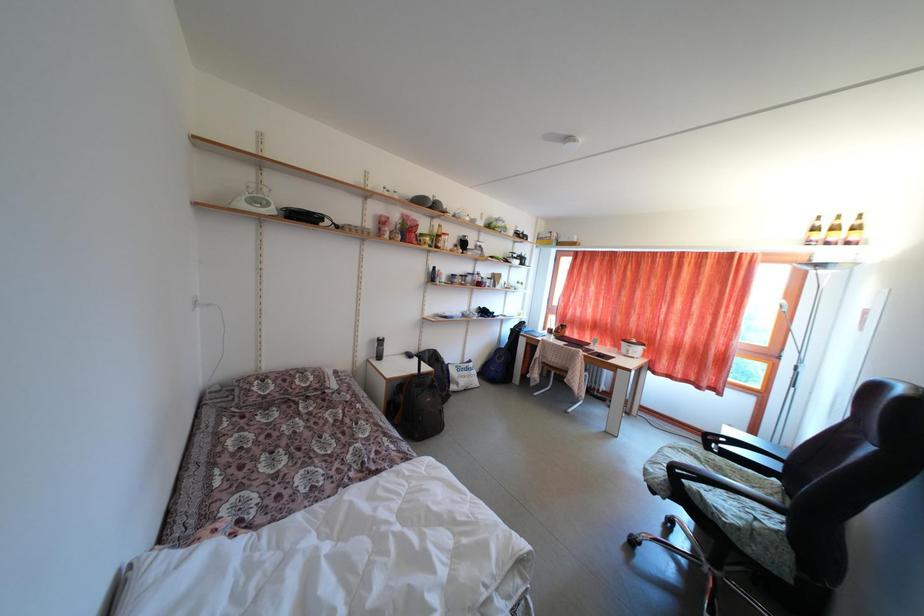
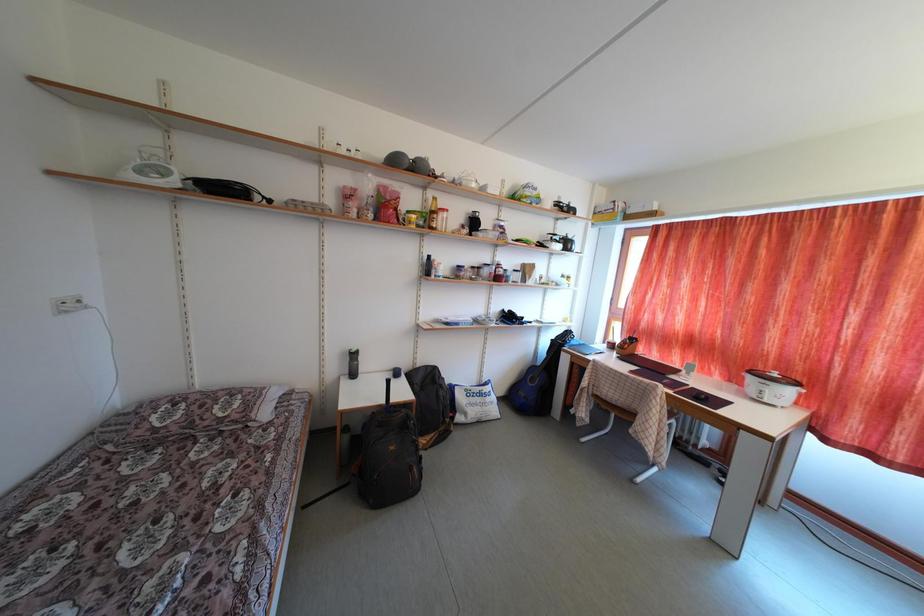
Question: The images are taken continuously from a first-person perspective. In which direction is your viewpoint rotating?

Choices:
 (A) Left
 (B) Right
 (C) Up
 (D) Down

Answer: (A)